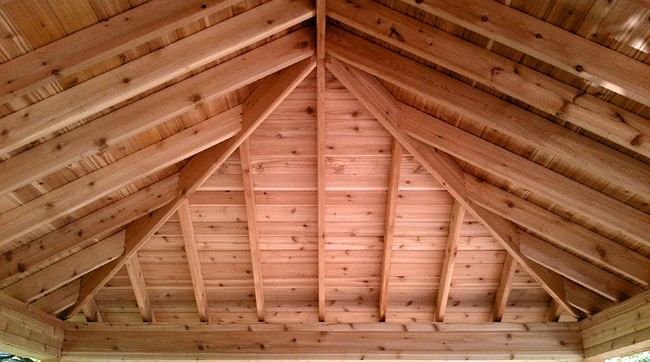
This screenshot has width=650, height=362. Identify the location of planks separating sections of ceiling. (214, 155), (450, 176), (320, 28).